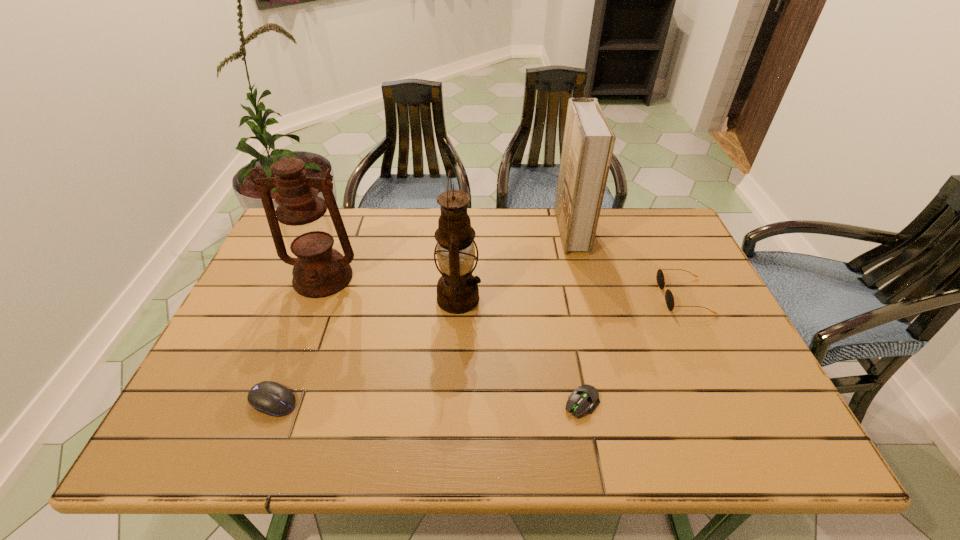
Locate an element on the screen. The width and height of the screenshot is (960, 540). blank area in the image that satisfies the following two spatial constraints: 1. on the back side of the taller computer mouse; 2. on the right side of the left oil lamp is located at coordinates (322, 278).

Where is `vacant position in the image that satisfies the following two spatial constraints: 1. on the cover of the farthest object; 2. on the front side of the shortest object`? This screenshot has width=960, height=540. vacant position in the image that satisfies the following two spatial constraints: 1. on the cover of the farthest object; 2. on the front side of the shortest object is located at coordinates (614, 403).

Identify the location of free point that satisfies the following two spatial constraints: 1. on the front-facing side of the sunglasses; 2. on the front side of the second shortest object. (733, 401).